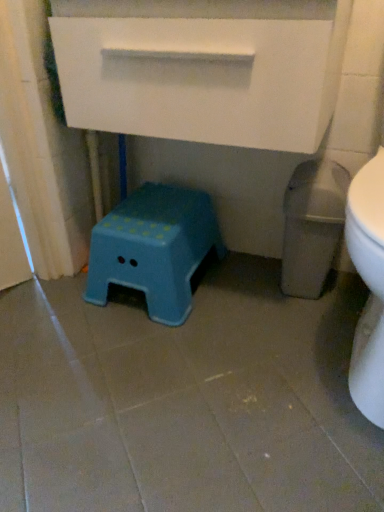
Question: Based on their sizes in the image, would you say blue plastic stool at lower left is bigger or smaller than white matte drawer at upper center?

Choices:
 (A) big
 (B) small

Answer: (B)

Question: Is point (178, 241) closer or farther from the camera than point (172, 94)?

Choices:
 (A) farther
 (B) closer

Answer: (A)

Question: Is blue plastic stool at lower left inside or outside of white matte drawer at upper center?

Choices:
 (A) inside
 (B) outside

Answer: (B)

Question: Choose the correct answer: Is white matte drawer at upper center inside blue plastic stool at lower left or outside it?

Choices:
 (A) inside
 (B) outside

Answer: (B)

Question: Based on their positions, is white matte drawer at upper center located to the left or right of blue plastic stool at lower left?

Choices:
 (A) left
 (B) right

Answer: (B)

Question: In terms of width, does white matte drawer at upper center look wider or thinner when compared to blue plastic stool at lower left?

Choices:
 (A) wide
 (B) thin

Answer: (A)

Question: Looking at the image, does white matte drawer at upper center seem bigger or smaller compared to blue plastic stool at lower left?

Choices:
 (A) big
 (B) small

Answer: (A)